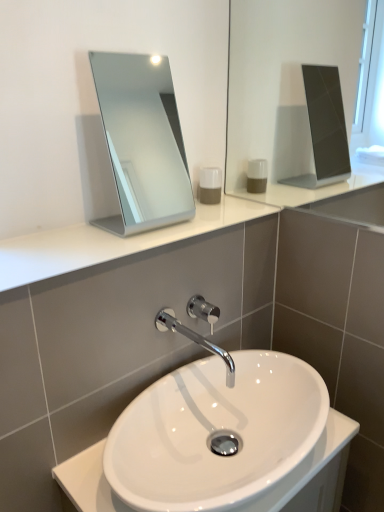
Where is `vacant area that is in front of translucent plastic soap dispenser at center`? Image resolution: width=384 pixels, height=512 pixels. vacant area that is in front of translucent plastic soap dispenser at center is located at coordinates (213, 216).